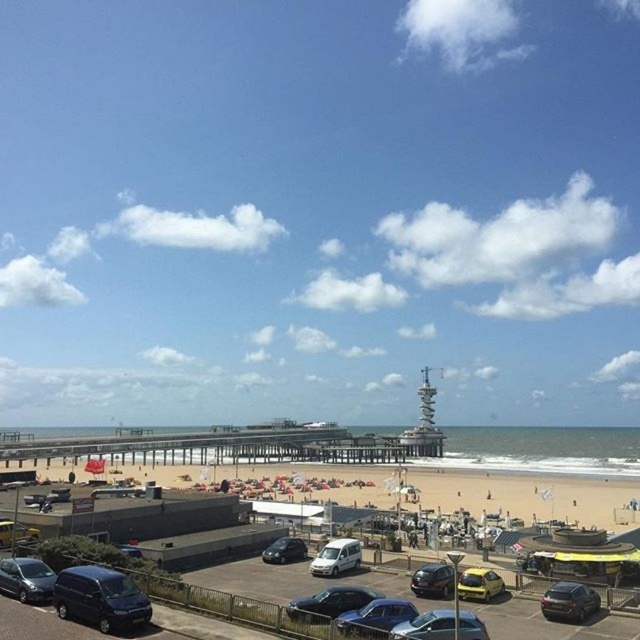
Question: Which point is farther to the camera?

Choices:
 (A) coord(371,593)
 (B) coord(12,529)
 (C) coord(422,634)

Answer: (B)

Question: Among these points, which one is farthest from the camera?

Choices:
 (A) pyautogui.click(x=362, y=593)
 (B) pyautogui.click(x=29, y=540)
 (C) pyautogui.click(x=417, y=611)
 (D) pyautogui.click(x=556, y=604)

Answer: (B)

Question: Can you confirm if beige sand at lower center is bigger than shiny black sedan at lower right?

Choices:
 (A) yes
 (B) no

Answer: (A)

Question: Does beige sand at lower center have a greater width compared to shiny silver car at lower left?

Choices:
 (A) yes
 (B) no

Answer: (A)

Question: Is beige sand at lower center positioned in front of shiny black car at lower center?

Choices:
 (A) no
 (B) yes

Answer: (A)

Question: Which is nearer to the satin black car at center?

Choices:
 (A) metallic silver car at lower center
 (B) satin silver sedan at lower center
 (C) beige sand at lower center
 (D) yellow matte car at lower center

Answer: (D)